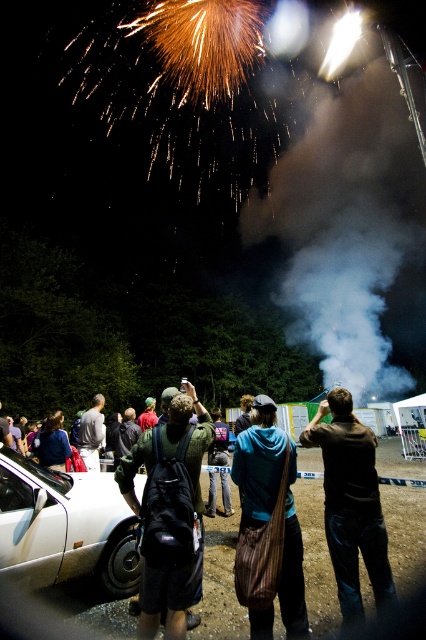
You are standing at the point labeled point (181, 620) and want to move to the point labeled point (92, 435). Which direction should you move to get closer to your destination?

You should move towards the direction away from the viewer because point (92, 435) is further from the viewer than point (181, 620).

You are standing at the point labeled as point (224, 435) and want to walk towards the fireworks display. There is an obstacle at point (109, 592). Can you safely walk around the obstacle to reach the fireworks?

Point (109, 592) is in front of point (224, 435), so the obstacle is closer to you. You need to navigate around it before proceeding toward the fireworks. Since you can move around it, you can safely reach the fireworks display.